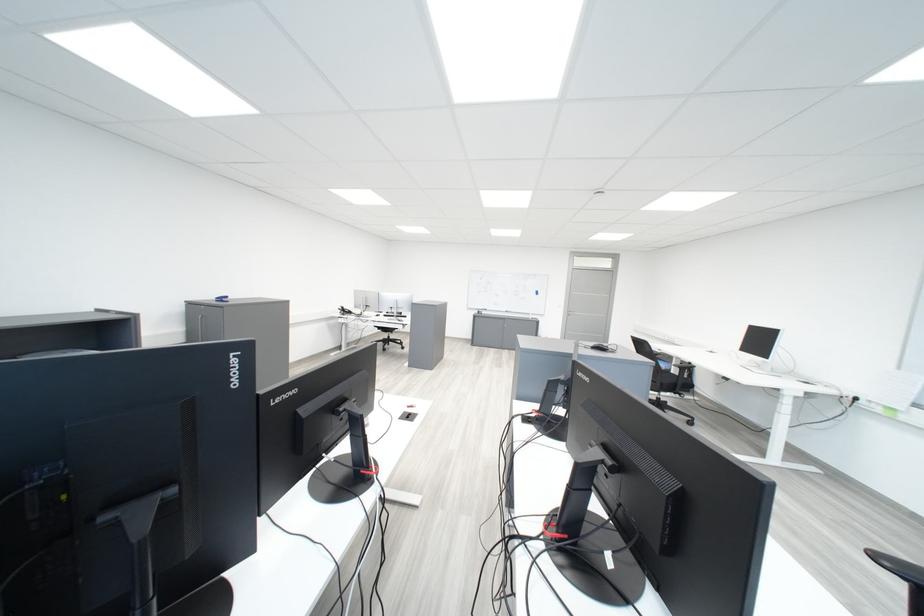
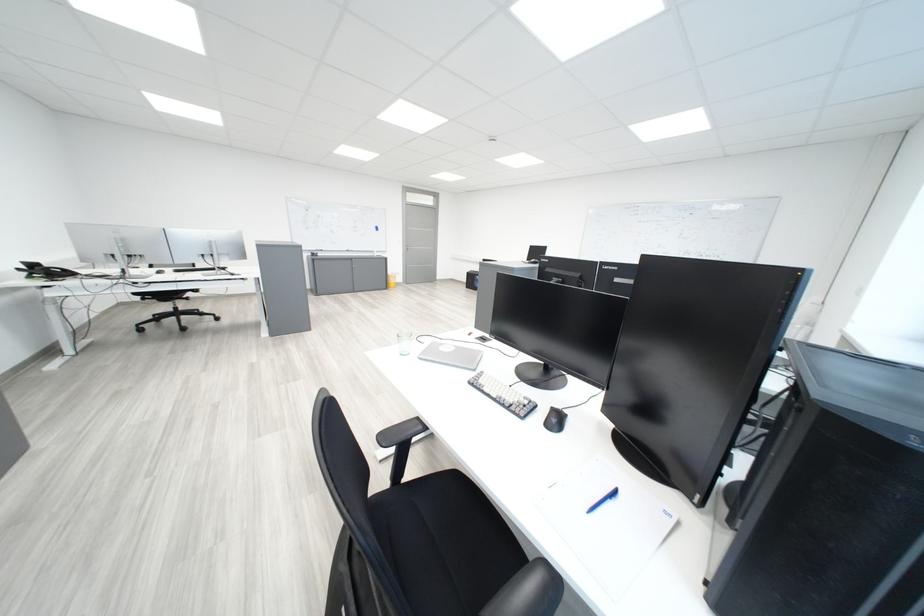
In the second image, find the point that corresponds to point (581, 315) in the first image.

(419, 251)